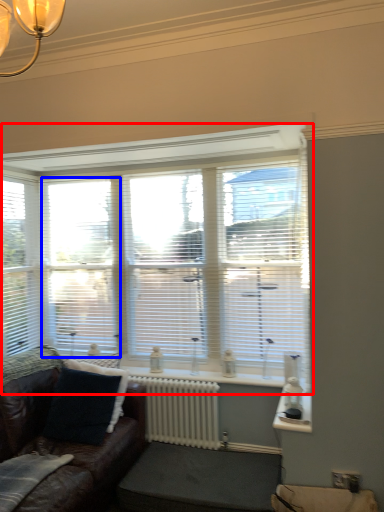
Question: Which point is further to the camera, window (highlighted by a red box) or blind (highlighted by a blue box)?

Choices:
 (A) window
 (B) blind

Answer: (B)